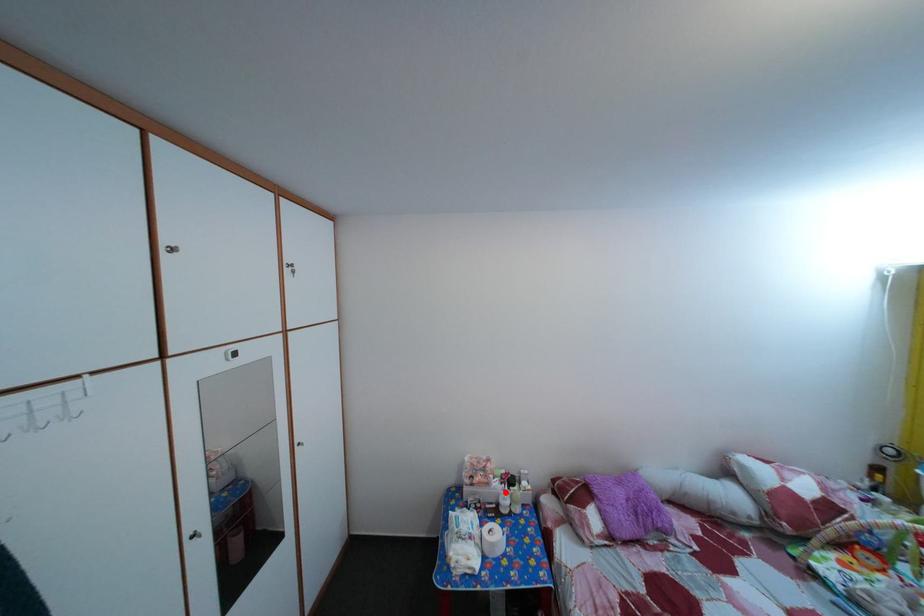
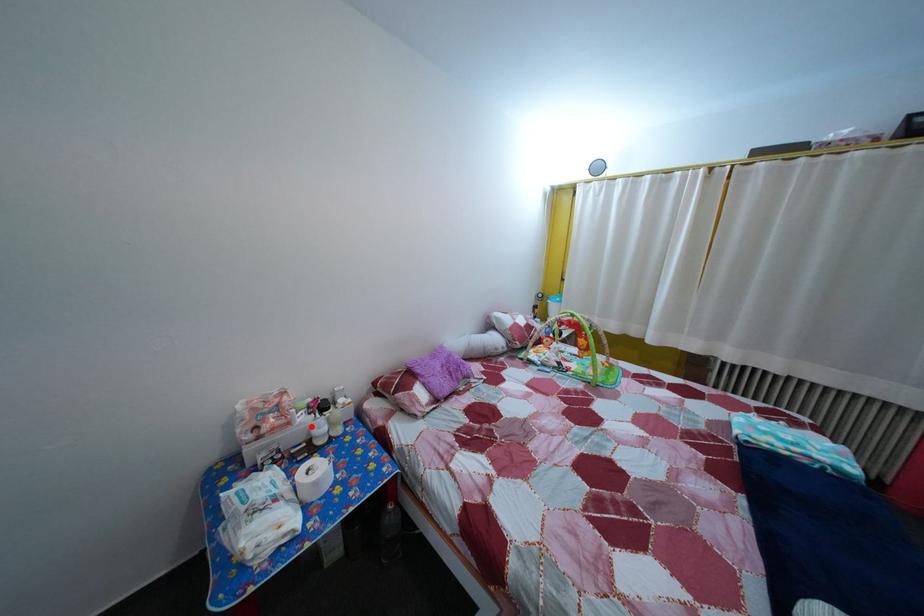
I am providing you with two images of the same scene from different viewpoints. A red point is marked on the first image and another point is marked on the second image. Do the highlighted points in image1 and image2 indicate the same real-world spot?

Yes